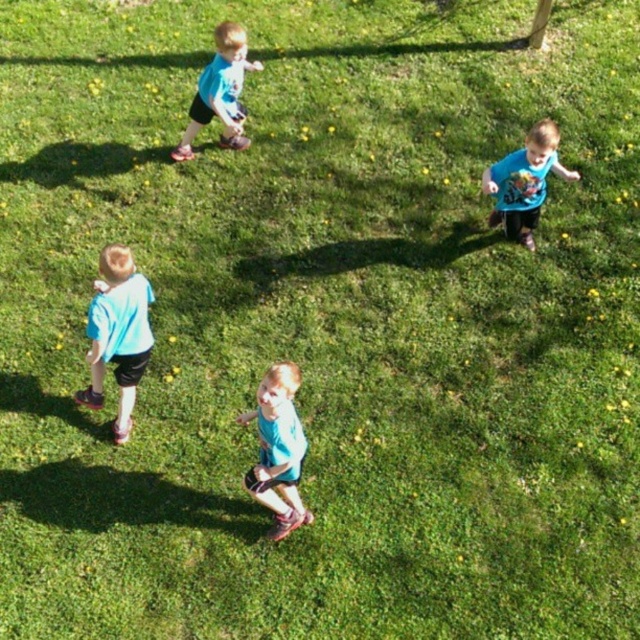
The image size is (640, 640). What do you see at coordinates (524, 182) in the screenshot?
I see `blue matte shirt at upper right` at bounding box center [524, 182].

Is point (541, 188) closer to viewer compared to point (202, 115)?

Yes.

Does point (538, 141) come closer to viewer compared to point (243, 140)?

Yes, point (538, 141) is closer to viewer.

Locate an element on the screen. blue matte shirt at upper right is located at coordinates (524, 182).

Which is more to the right, blue matte shorts at center or matte blue shirt at upper left?

blue matte shorts at center

Is blue matte shorts at center positioned in front of matte blue shirt at upper left?

Yes, blue matte shorts at center is closer to the viewer.

Between point (298, 378) and point (237, 112), which one is positioned behind?

Point (237, 112)

The height and width of the screenshot is (640, 640). I want to click on blue matte shorts at center, so click(278, 449).

Locate an element on the screen. blue matte shorts at center is located at coordinates tap(278, 449).

Does blue matte shorts at center have a larger size compared to blue matte shirt at upper right?

No, blue matte shorts at center is not bigger than blue matte shirt at upper right.

Between point (296, 509) and point (528, 211), which one is positioned behind?

The point (528, 211) is behind.

Where is `blue matte shorts at center`? The height and width of the screenshot is (640, 640). blue matte shorts at center is located at coordinates (278, 449).